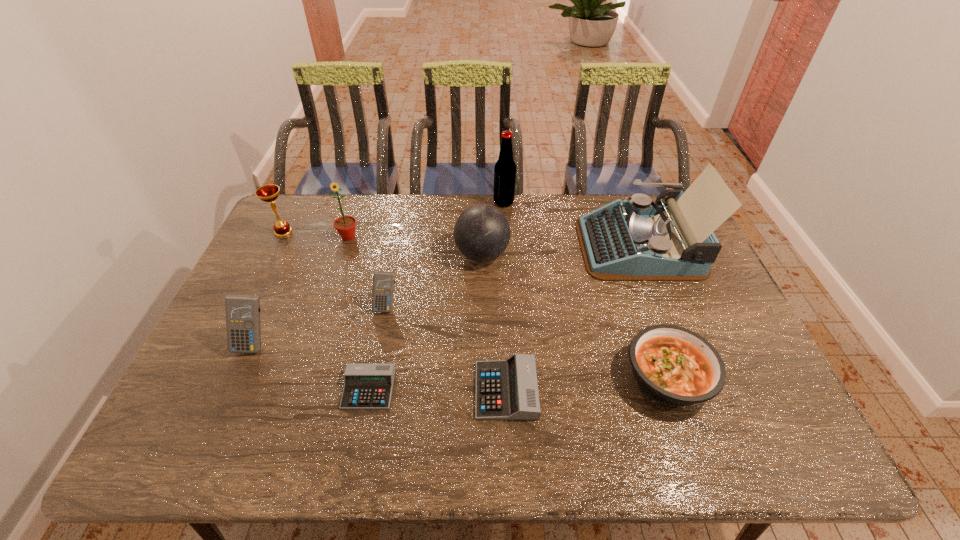
The height and width of the screenshot is (540, 960). I want to click on typewriter that is at the far edge, so click(639, 240).

Locate an element on the screen. This screenshot has height=540, width=960. sunflower that is at the far edge is located at coordinates (345, 225).

Find the location of a particular element. chalice that is at the far edge is located at coordinates (269, 193).

What are the coordinates of `chalice situated at the left edge` in the screenshot? It's located at (269, 193).

Locate an element on the screen. Image resolution: width=960 pixels, height=540 pixels. calculator located in the left edge section of the desktop is located at coordinates (242, 311).

At what (x,y) coordinates should I click in order to perform the action: click on typewriter that is at the right edge. Please return your answer as a coordinate pair (x, y). Looking at the image, I should click on coord(639,240).

Find the location of a particular element. stew present at the right edge is located at coordinates (675, 366).

The height and width of the screenshot is (540, 960). I want to click on object situated at the far left corner, so click(269, 193).

Find the location of a particular element. object present at the far right corner is located at coordinates (639, 240).

The image size is (960, 540). What are the coordinates of `free space at the far edge` in the screenshot? It's located at (372, 225).